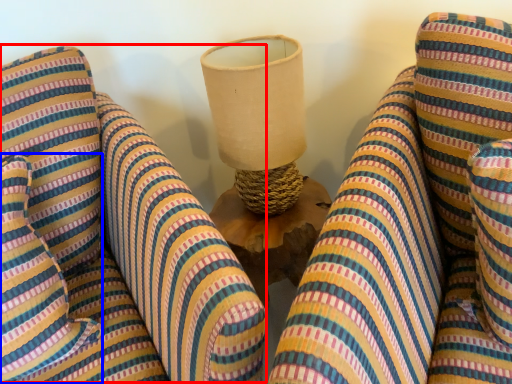
Question: Among these objects, which one is farthest to the camera, bean bag chair (highlighted by a red box) or pillow (highlighted by a blue box)?

Choices:
 (A) bean bag chair
 (B) pillow

Answer: (B)